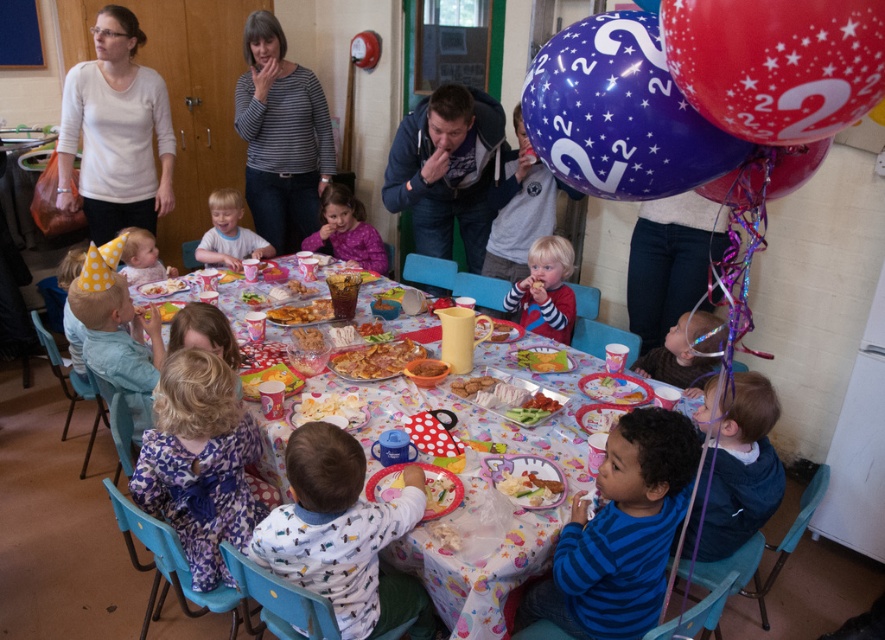
You are a parent at the birthday party and want to ensure your child can reach both the white matte shirt at upper left and the matte yellow cake at center on the table. Since the shirt is larger, does that mean it is closer to the child than the cake?

The white matte shirt at upper left is larger in size than the matte yellow cake at center, but size does not necessarily indicate distance. The shirt could be closer or farther away depending on its actual position relative to the child.

You are a photographer at the birthday party. You want to take a photo of the white matte shirt at upper left and the matte yellow cake at center so that both are clearly visible. Considering their heights, which object should you adjust the camera angle to focus on to ensure both are in frame?

Since the white matte shirt at upper left is taller than the matte yellow cake at center, you should lower the camera angle slightly to ensure both are in frame, focusing on the taller object first.

Consider the image. You are a parent at the birthday party and want to place a small toy between the purple fleece jacket at center and the crusty bread at center on the table. Which object should you place the toy closer to so that it doesn

The purple fleece jacket at center is taller than the crusty bread at center, so you should place the toy closer to the crusty bread at center to ensure it is visible to the children.